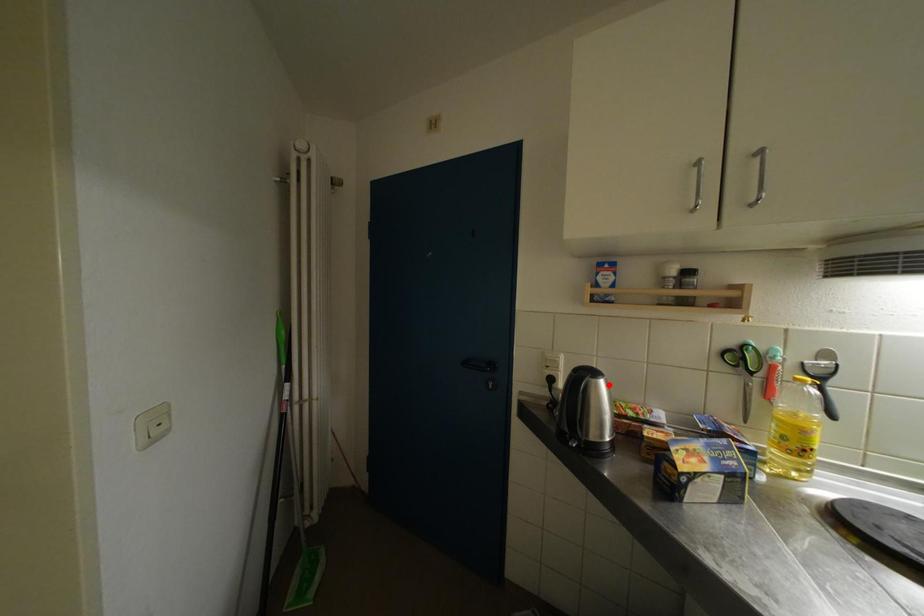
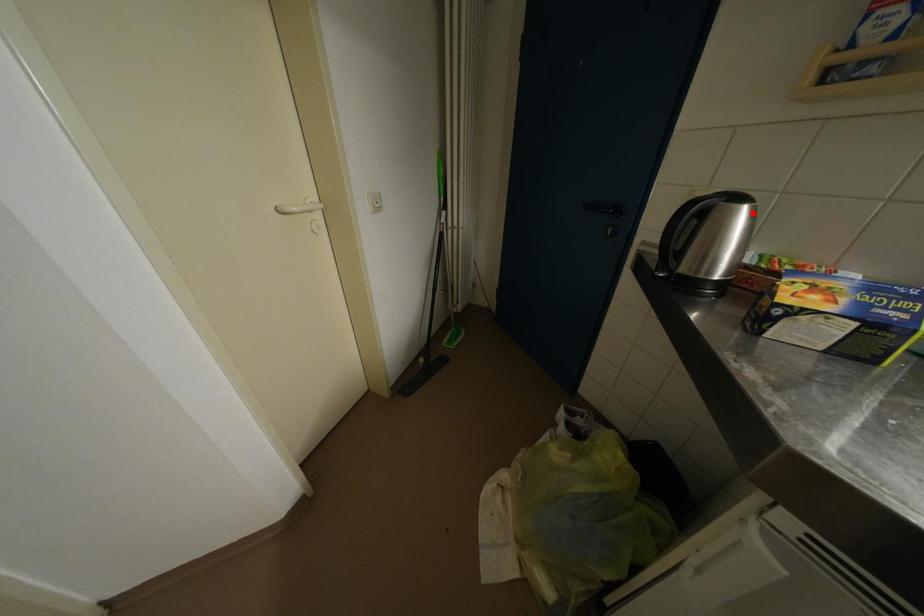
I am providing you with two images of the same scene from different viewpoints. A red point is marked on the first image and another point is marked on the second image. Is the marked point in image1 the same physical position as the marked point in image2?

Yes